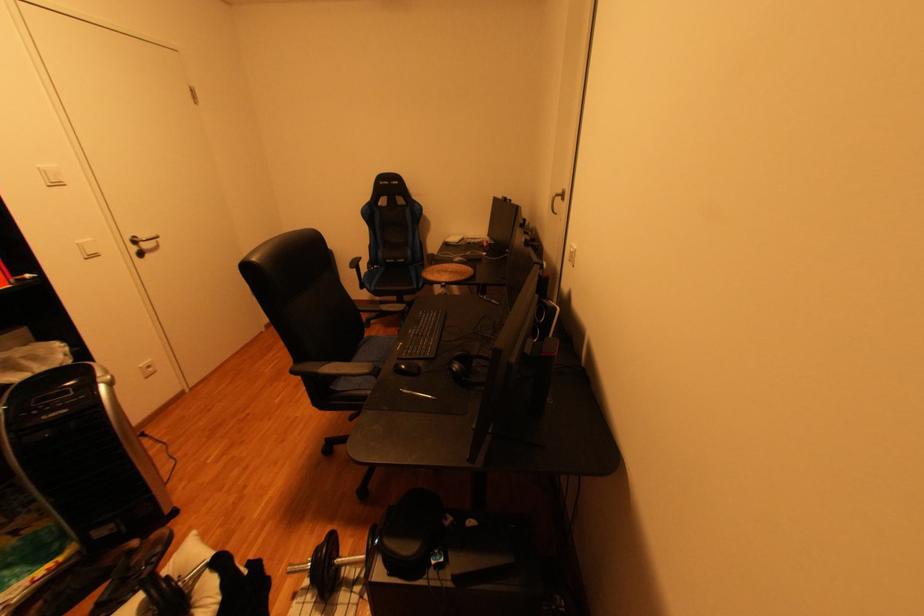
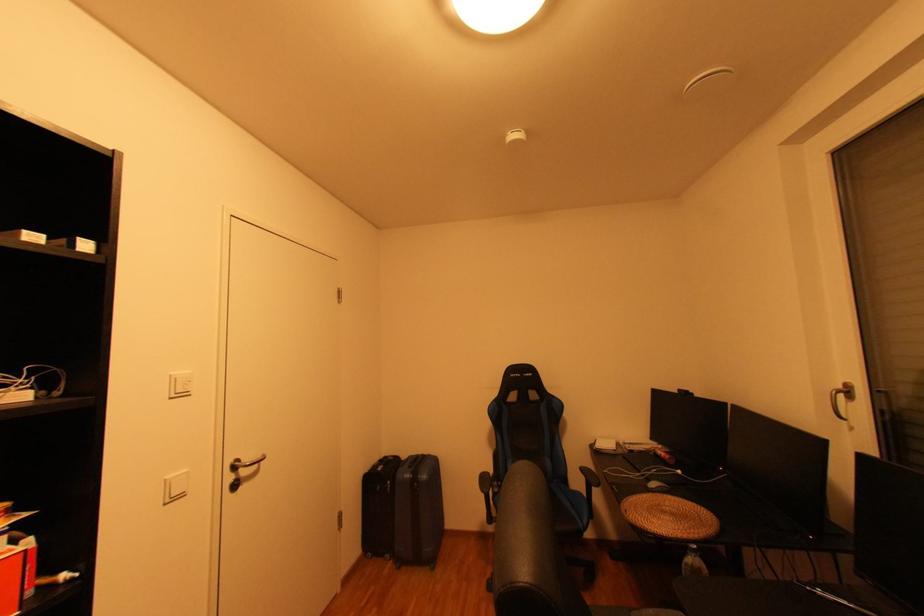
In the second image, find the point that corresponds to [55,172] in the first image.

(185, 379)